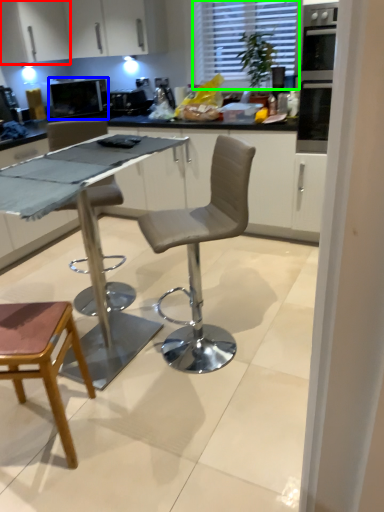
Question: Based on their relative distances, which object is farther from cabinetry (highlighted by a red box)? Choose from appliance (highlighted by a blue box) and window (highlighted by a green box).

Choices:
 (A) appliance
 (B) window

Answer: (B)